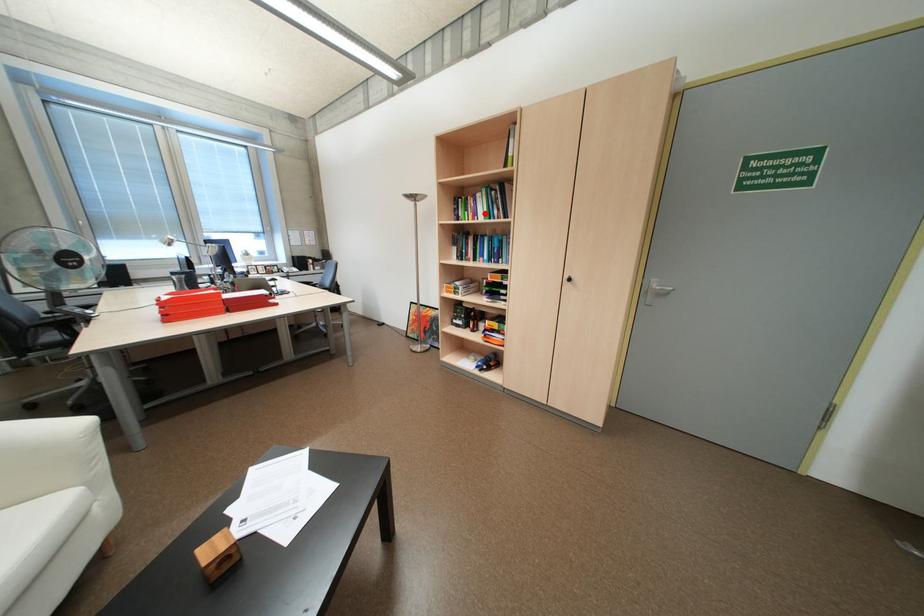
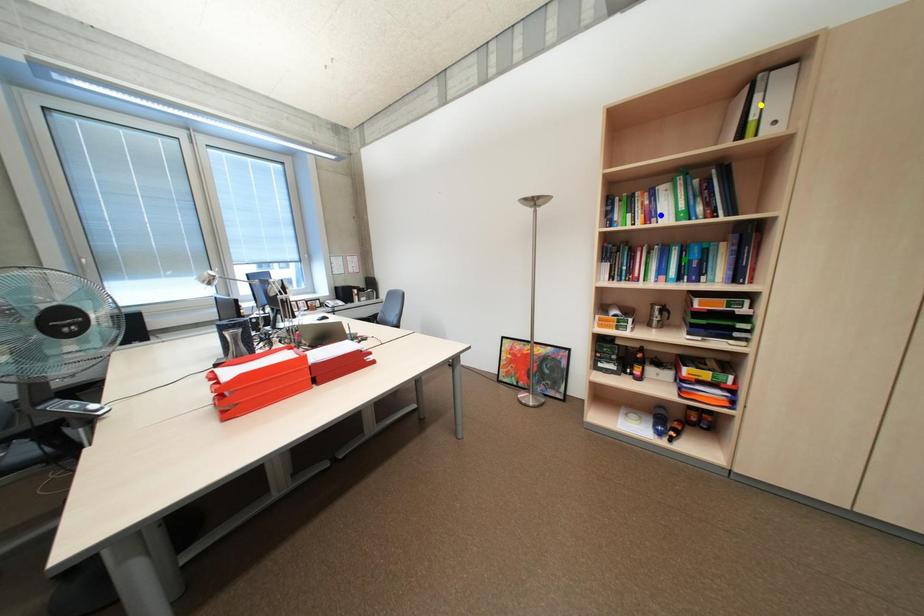
Question: I am providing you with two images of the same scene from different viewpoints. A red point is marked on the first image. You are given multiple points on the second image. Which point in image 2 represents the same 3d spot as the red point in image 1?

Choices:
 (A) blue point
 (B) yellow point
 (C) green point

Answer: (A)